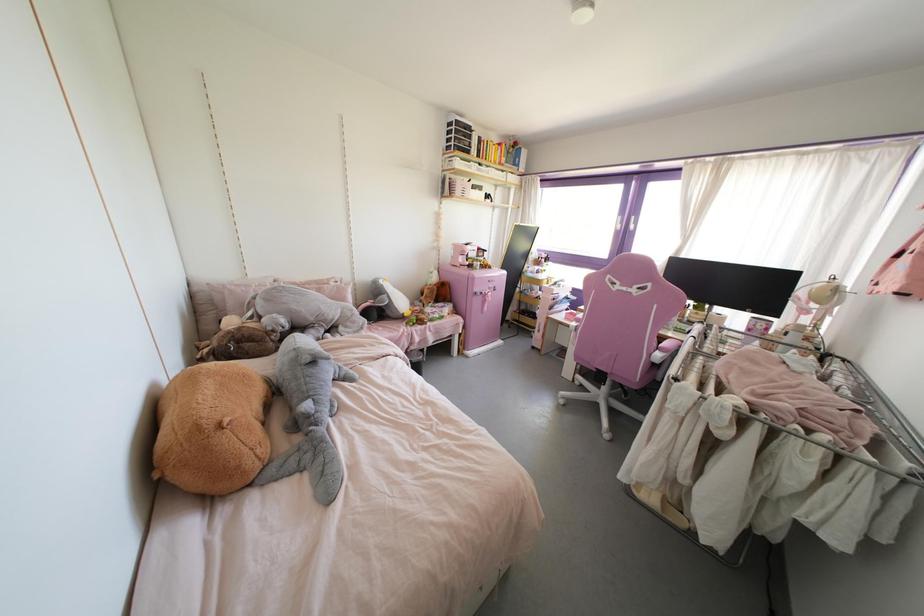
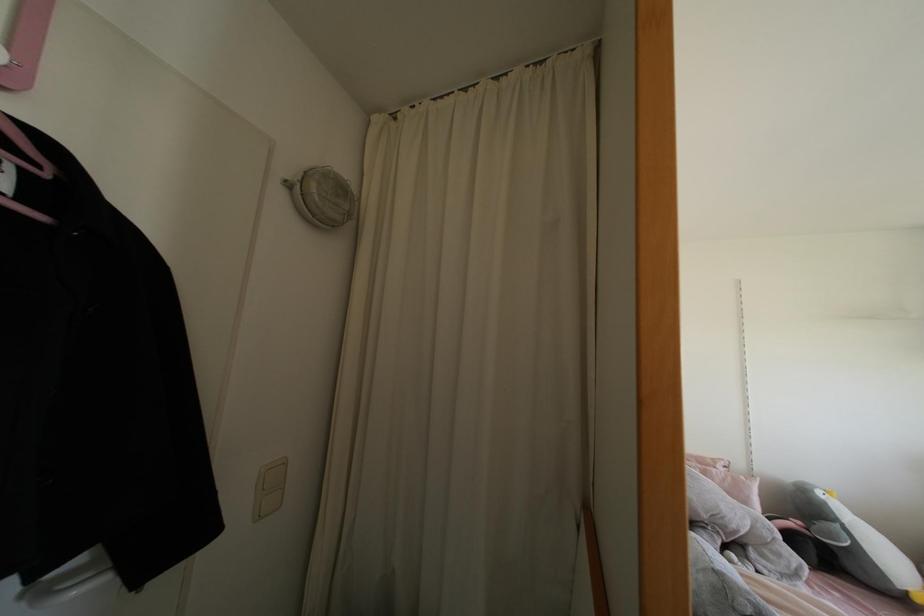
In the second image, find the point that corresponds to pixel 381 281 in the first image.

(819, 493)